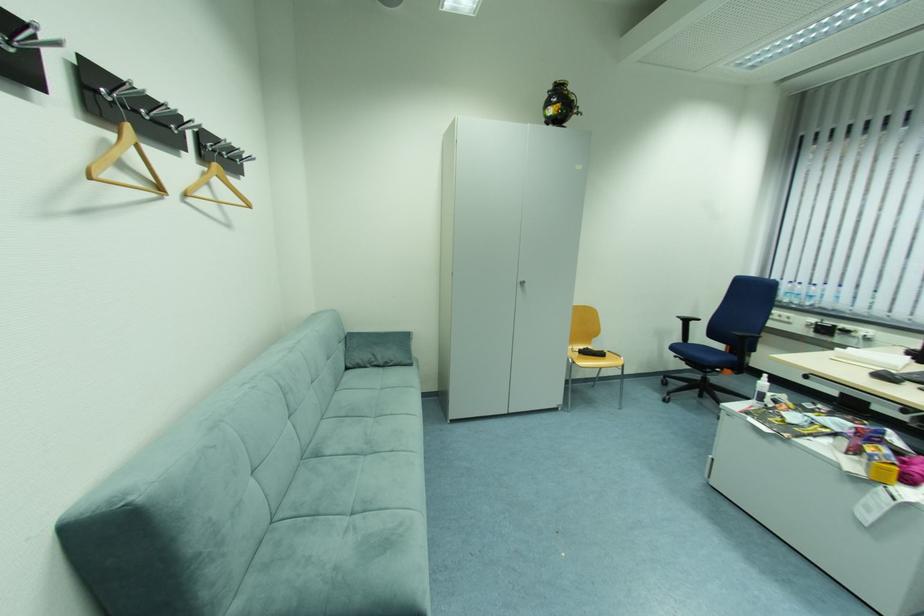
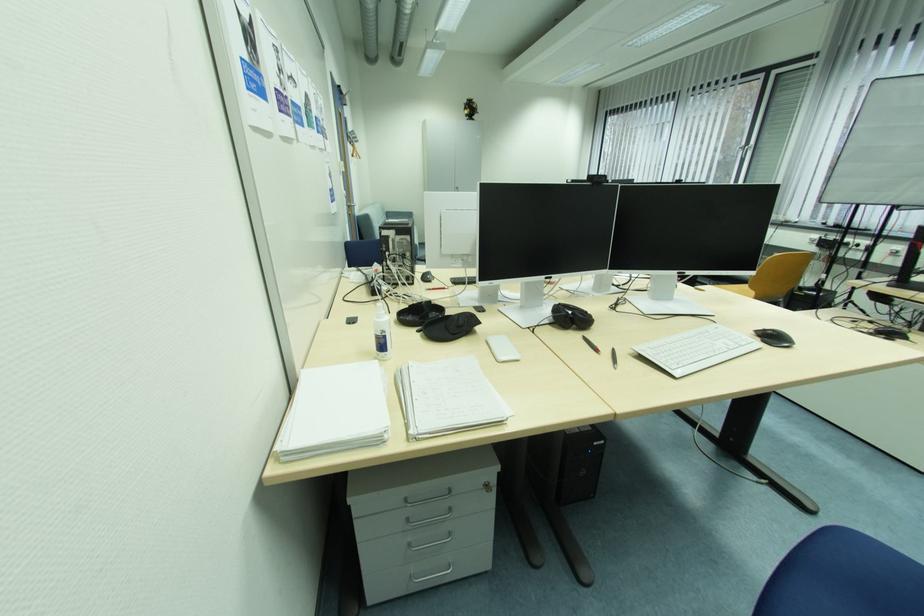
Question: I am providing you with two images of the same scene from different viewpoints. Please identify which objects are invisible in image2.

Choices:
 (A) white paper towel roll
 (B) black webcam
 (C) white spray bottle
 (D) spiral notebook

Answer: (C)